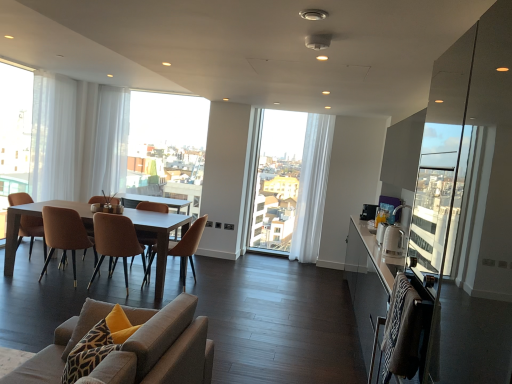
This screenshot has width=512, height=384. Describe the element at coordinates (291, 184) in the screenshot. I see `transparent glass window at center` at that location.

Measure the distance between point (314, 260) and camera.

Point (314, 260) and camera are 6.20 meters apart.

This screenshot has height=384, width=512. Find the location of `textured beige sofa at lower left, arranged as the 5th chair when viewed from the back`. textured beige sofa at lower left, arranged as the 5th chair when viewed from the back is located at coordinates (162, 348).

What is the approximate width of white sheer curtain at left, which is counted as the 3th curtain, starting from the right?

white sheer curtain at left, which is counted as the 3th curtain, starting from the right, is 10.43 inches wide.

The image size is (512, 384). Describe the element at coordinates (14, 133) in the screenshot. I see `white sheer curtain at left, acting as the 1th window screen starting from the front` at that location.

Locate an element on the screen. brown fabric chair at center, the 3th chair viewed from the front is located at coordinates (65, 235).

Is white sheer curtain at upper left, placed as the second window screen when sorted from front to back, positioned behind white sheer curtain at left, acting as the 2th window screen starting from the right?

Yes, it is.

This screenshot has width=512, height=384. In order to click on window screen in front of the white sheer curtain at upper left, the first window screen in the right-to-left sequence in this screenshot , I will do `click(14, 133)`.

Considering the sizes of objects white sheer curtain at upper left, the 2th window screen from the left, and white sheer curtain at left, acting as the 2th window screen starting from the right, in the image provided, who is smaller, white sheer curtain at upper left, the 2th window screen from the left, or white sheer curtain at left, acting as the 2th window screen starting from the right,?

Smaller between the two is white sheer curtain at left, acting as the 2th window screen starting from the right.

Considering the relative positions of white sheer curtain at upper left, the first window screen in the right-to-left sequence, and white sheer curtain at left, which ranks as the 1th window screen in left-to-right order, in the image provided, is white sheer curtain at upper left, the first window screen in the right-to-left sequence, to the right of white sheer curtain at left, which ranks as the 1th window screen in left-to-right order, from the viewer's perspective?

Indeed, white sheer curtain at upper left, the first window screen in the right-to-left sequence, is positioned on the right side of white sheer curtain at left, which ranks as the 1th window screen in left-to-right order.

Is transparent glass window at center further to camera compared to brown leather chair at center, the fourth chair viewed from the back?

Yes.

Considering the sizes of objects transparent glass window at center and brown leather chair at center, the fourth chair viewed from the back, in the image provided, who is bigger, transparent glass window at center or brown leather chair at center, the fourth chair viewed from the back,?

Bigger between the two is transparent glass window at center.

Considering the positions of points (314, 141) and (99, 246), is point (314, 141) closer to camera compared to point (99, 246)?

No, it is not.

Can we say transparent glass window at center lies outside brown leather chair at center, the 2th chair from the front?

transparent glass window at center is positioned outside brown leather chair at center, the 2th chair from the front.

Which is in front, point (53, 203) or point (187, 237)?

Positioned in front is point (187, 237).

From the image's perspective, would you say matte wooden table at center is positioned over brown leather chair at center, the 2th chair when ordered from back to front?

Yes, from the image's perspective, matte wooden table at center is above brown leather chair at center, the 2th chair when ordered from back to front.

Is matte wooden table at center in front of brown leather chair at center, the 2th chair when ordered from back to front?

Yes, matte wooden table at center is closer to the viewer.

Which object is positioned more to the left, matte wooden table at center or brown leather chair at center, the fourth chair in the front-to-back sequence?

matte wooden table at center.

Is matte wooden table at center oriented away from textured beige sofa at lower left, which appears as the first chair when viewed from the front?

No, matte wooden table at center is not facing the opposite direction of textured beige sofa at lower left, which appears as the first chair when viewed from the front.

Considering the sizes of objects matte wooden table at center and textured beige sofa at lower left, which appears as the first chair when viewed from the front, in the image provided, who is taller, matte wooden table at center or textured beige sofa at lower left, which appears as the first chair when viewed from the front,?

textured beige sofa at lower left, which appears as the first chair when viewed from the front, is taller.

Between matte wooden table at center and textured beige sofa at lower left, which appears as the first chair when viewed from the front, which one appears on the left side from the viewer's perspective?

Positioned to the left is matte wooden table at center.

Does point (52, 201) come in front of point (23, 364)?

No.

Looking at the image, does brown leather chair at center, the fourth chair viewed from the back, seem bigger or smaller compared to white sheer curtain at left, placed as the 2th curtain when sorted from left to right?

brown leather chair at center, the fourth chair viewed from the back, is smaller than white sheer curtain at left, placed as the 2th curtain when sorted from left to right.

From the image's perspective, between brown leather chair at center, the 2th chair from the front, and white sheer curtain at left, placed as the 2th curtain when sorted from left to right, who is located below?

brown leather chair at center, the 2th chair from the front, appears lower in the image.

Can you confirm if brown leather chair at center, the fourth chair viewed from the back, is wider than white sheer curtain at left, positioned as the 2th curtain in right-to-left order?

Correct, the width of brown leather chair at center, the fourth chair viewed from the back, exceeds that of white sheer curtain at left, positioned as the 2th curtain in right-to-left order.

From their relative heights in the image, would you say brown leather chair at center, the 2th chair from the front, is taller or shorter than white sheer curtain at left, positioned as the 2th curtain in right-to-left order?

Clearly, brown leather chair at center, the 2th chair from the front, is shorter compared to white sheer curtain at left, positioned as the 2th curtain in right-to-left order.

From a real-world perspective, which chair is the 2nd one above the matte brown chair at left, which is the 5th chair from front to back? Please provide its 2D coordinates.

[(115, 242)]

Which is correct: brown leather chair at center, the 2th chair from the front, is inside matte brown chair at left, which is the 5th chair from front to back, or outside of it?

brown leather chair at center, the 2th chair from the front, cannot be found inside matte brown chair at left, which is the 5th chair from front to back.

Is brown leather chair at center, the 2th chair from the front, far away from matte brown chair at left, which is the 5th chair from front to back?

Actually, brown leather chair at center, the 2th chair from the front, and matte brown chair at left, which is the 5th chair from front to back, are a little close together.

Between brown leather chair at center, the 2th chair from the front, and matte brown chair at left, the first chair positioned from the back, which one has larger size?

Bigger between the two is matte brown chair at left, the first chair positioned from the back.

Based on the photo, from the image's perspective, is white sheer curtain at left, placed as the 2th curtain when sorted from left to right, under textured beige sofa at lower left, arranged as the 5th chair when viewed from the back?

No, from the image's perspective, white sheer curtain at left, placed as the 2th curtain when sorted from left to right, is not beneath textured beige sofa at lower left, arranged as the 5th chair when viewed from the back.

Is white sheer curtain at left, placed as the 2th curtain when sorted from left to right, in front of textured beige sofa at lower left, arranged as the 5th chair when viewed from the back?

That is False.

Which is closer, (117, 100) or (145, 337)?

Point (117, 100) appears to be farther away from the viewer than point (145, 337).

Can you tell me how much white sheer curtain at left, placed as the 2th curtain when sorted from left to right, and textured beige sofa at lower left, arranged as the 5th chair when viewed from the back, differ in facing direction?

There is a 90.9-degree angle between the facing directions of white sheer curtain at left, placed as the 2th curtain when sorted from left to right, and textured beige sofa at lower left, arranged as the 5th chair when viewed from the back.

Locate an element on the screen. window screen behind the white sheer curtain at left, which ranks as the 1th window screen in left-to-right order is located at coordinates (167, 146).

From a real-world perspective, count 3rd chairs downward from the transparent glass window at center and point to it. Please provide its 2D coordinates.

[(115, 242)]

Estimate the real-world distances between objects in this image. Which object is closer to white sheer curtain at upper left, placed as the second window screen when sorted from front to back, white sheer curtain at left, placed as the 2th curtain when sorted from left to right, or brown leather chair at center, the fourth chair in the front-to-back sequence?

white sheer curtain at left, placed as the 2th curtain when sorted from left to right, is closer to white sheer curtain at upper left, placed as the second window screen when sorted from front to back.

Which object lies nearer to the anchor point matte brown chair at left, which is the 5th chair from front to back, matte wooden table at center or textured beige sofa at lower left, arranged as the 5th chair when viewed from the back?

matte wooden table at center.

From the image, which object appears to be nearer to white sheer curtain at left, the 2th window screen in the back-to-front sequence, brown leather chair at center, the 2th chair when ordered from back to front, or textured beige sofa at lower left, which appears as the first chair when viewed from the front?

brown leather chair at center, the 2th chair when ordered from back to front, is closer to white sheer curtain at left, the 2th window screen in the back-to-front sequence.

Based on their spatial positions, is white sheer curtain at center, placed as the 3th curtain when sorted from left to right, or white sheer curtain at upper left, positioned as the 1th window screen in back-to-front order, closer to matte brown chair at left, which is the 5th chair from front to back?

Based on the image, white sheer curtain at upper left, positioned as the 1th window screen in back-to-front order, appears to be nearer to matte brown chair at left, which is the 5th chair from front to back.

When comparing their distances from matte brown chair at left, which is the 5th chair from front to back, does white sheer curtain at left, the 2th window screen in the back-to-front sequence, or white sheer curtain at center, placed as the 3th curtain when sorted from left to right, seem closer?

white sheer curtain at left, the 2th window screen in the back-to-front sequence.

In the scene shown: Estimate the real-world distances between objects in this image. Which object is further from white sheer curtain at upper left, placed as the second window screen when sorted from front to back, transparent glass window at center or white sheer curtain at left, which is counted as the 3th curtain, starting from the right?

Among the two, transparent glass window at center is located further to white sheer curtain at upper left, placed as the second window screen when sorted from front to back.

Estimate the real-world distances between objects in this image. Which object is further from matte wooden table at center, brown fabric chair at center, the 3th chair viewed from the front, or white sheer curtain at center, placed as the 3th curtain when sorted from left to right?

white sheer curtain at center, placed as the 3th curtain when sorted from left to right.

Considering their positions, is matte brown chair at left, the first chair positioned from the back, positioned further to textured beige sofa at lower left, which appears as the first chair when viewed from the front, than white sheer curtain at left, arranged as the first curtain when viewed from the left?

white sheer curtain at left, arranged as the first curtain when viewed from the left, lies further to textured beige sofa at lower left, which appears as the first chair when viewed from the front, than the other object.

The image size is (512, 384). I want to click on coffee table between matte brown chair at left, which is the 5th chair from front to back, and transparent glass window at center from left to right, so click(x=159, y=237).

Locate an element on the screen. This screenshot has height=384, width=512. coffee table between brown fabric chair at center, which is counted as the 3th chair, starting from the back, and white sheer curtain at upper left, placed as the second window screen when sorted from front to back, from front to back is located at coordinates (159, 237).

Image resolution: width=512 pixels, height=384 pixels. I want to click on chair between brown fabric chair at center, the 3th chair viewed from the front, and brown leather chair at center, the fourth chair in the front-to-back sequence, in the horizontal direction, so click(x=115, y=242).

Find the location of a particular element. This screenshot has width=512, height=384. curtain between white sheer curtain at left, which is counted as the 3th curtain, starting from the right, and white sheer curtain at center, the 1th curtain from the right, from left to right is located at coordinates tap(110, 141).